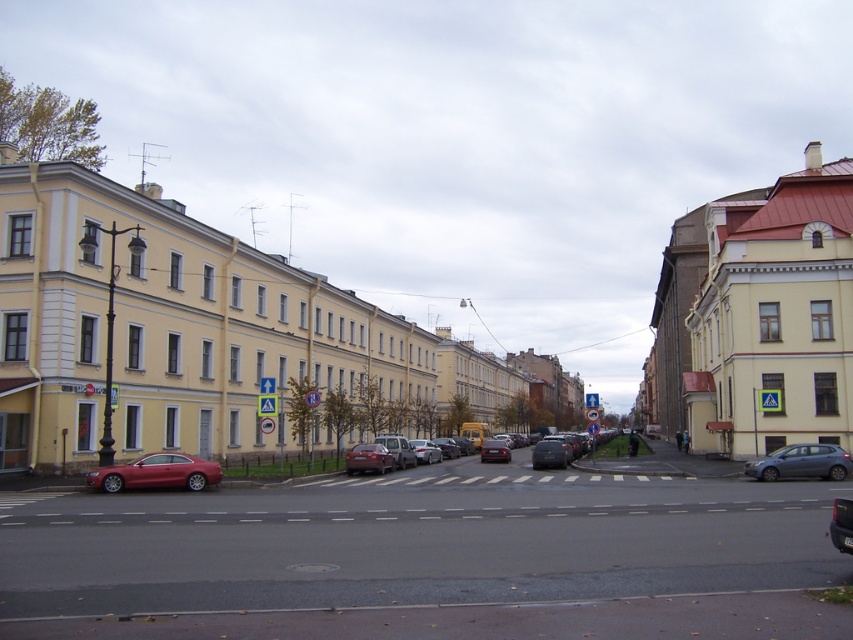
You are standing at the point marked by coordinates (840,524) in the image. What object are you directly at?

You are directly at the metallic gray sedan at center marked by the point coordinates (840,524).

You are driving a car and want to make a U turn in the street. There is a satin silver sedan at lower right and a metallic silver sedan at center blocking your path. Which car do you need to wait for to move first before proceeding?

You need to wait for the satin silver sedan at lower right to move first because it is in front of the metallic silver sedan at center, so it has the right of way.